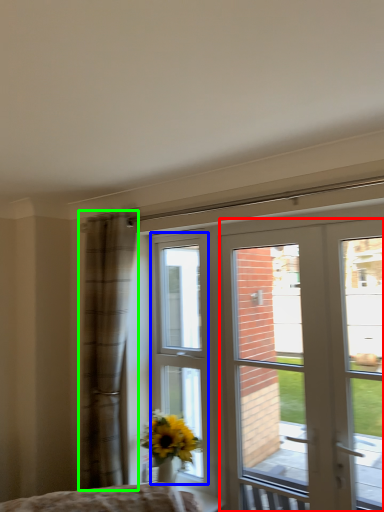
Question: Estimate the real-world distances between objects in this image. Which object is closer to door (highlighted by a red box), bay window (highlighted by a blue box) or curtain (highlighted by a green box)?

Choices:
 (A) bay window
 (B) curtain

Answer: (B)